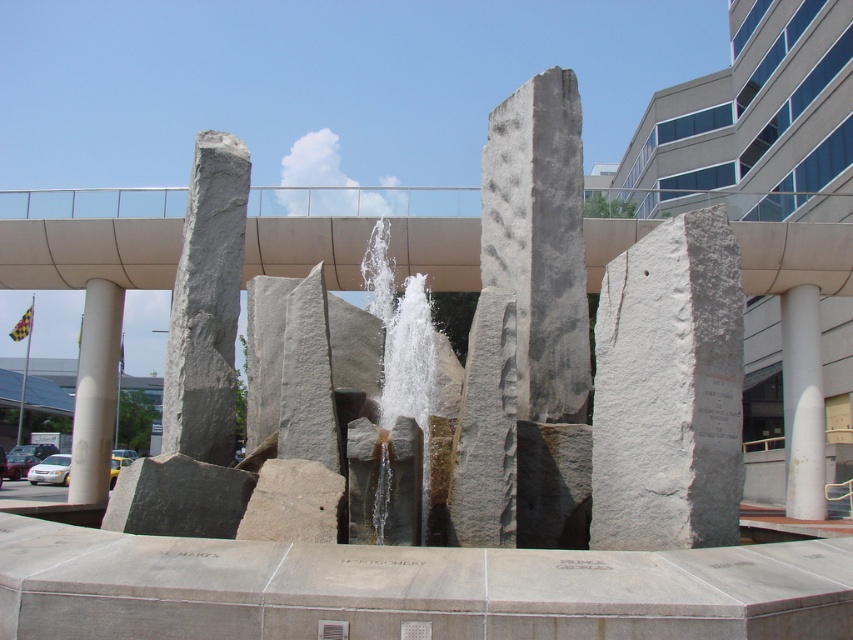
Question: Does white smooth column at right have a lesser width compared to white smooth column at left?

Choices:
 (A) no
 (B) yes

Answer: (A)

Question: Can you confirm if white stone pillar at center is smaller than white smooth column at right?

Choices:
 (A) no
 (B) yes

Answer: (B)

Question: Does white stone pillar at center come in front of gray rough stone pillar at upper left?

Choices:
 (A) yes
 (B) no

Answer: (A)

Question: Which of these objects is positioned farthest from the white smooth column at left?

Choices:
 (A) white stone waterfall at center
 (B) white stone pillar at center
 (C) gray rough stone pillar at upper left
 (D) white smooth column at right

Answer: (D)

Question: Which object is farther from the camera taking this photo?

Choices:
 (A) white smooth column at right
 (B) white smooth column at left
 (C) gray rough stone pillar at upper left
 (D) white stone pillar at center

Answer: (A)

Question: Which point is closer to the camera?

Choices:
 (A) (409, 388)
 (B) (103, 442)

Answer: (A)